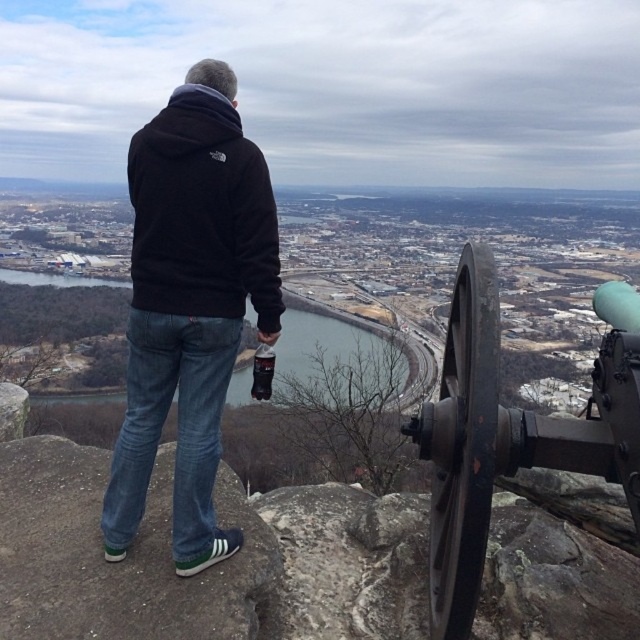
You are a fashion designer observing the person in the scene. You need to determine which clothing item is shorter between the blue jeans at center and the black fleece hoodie at upper center. Which one is shorter?

The blue jeans at center is shorter than the black fleece hoodie at upper center.

You are standing at the viewpoint overlooking the city and want to place a small flag at the closest point between point (129, 509) and point (474, 304). Which point should you choose?

Point (129, 509) is closer to the viewer than point (474, 304), so you should place the flag at point (129, 509).